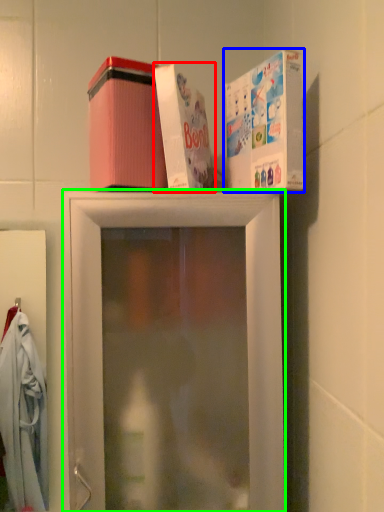
Question: Which object is positioned farthest from box (highlighted by a red box)? Select from box (highlighted by a blue box) and shelf (highlighted by a green box).

Choices:
 (A) box
 (B) shelf

Answer: (B)